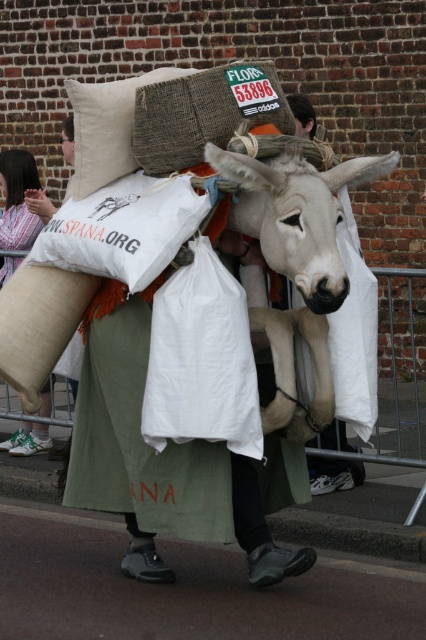
You are an event organizer setting up a promotional booth. You have a white matte donkey at center and a beige fabric pillow at upper left. Which object is wider?

The white matte donkey at center is wider than the beige fabric pillow at upper left.

You are a photographer trying to capture a symmetrical composition. You notice the white matte donkey at center and the beige fabric pillow at upper left in the scene. Which object should you position to the left of the other to achieve symmetry?

To achieve symmetry, position the beige fabric pillow at upper left to the left of the white matte donkey at center since the white matte donkey at center is already to the right of the beige fabric pillow at upper left.

You are a photographer setting up a shoot in a studio. You have a white matte donkey at center and a beige fabric pillow at upper left. The distance between them is crucial for your composition. If your camera can focus on objects within a 30 inch range from the center, will both items be in focus?

The white matte donkey at center is 34.91 inches from the beige fabric pillow at upper left. Since the camera can focus within 30 inches, the distance between them exceeds the focus range. Therefore, both items cannot be in focus simultaneously.